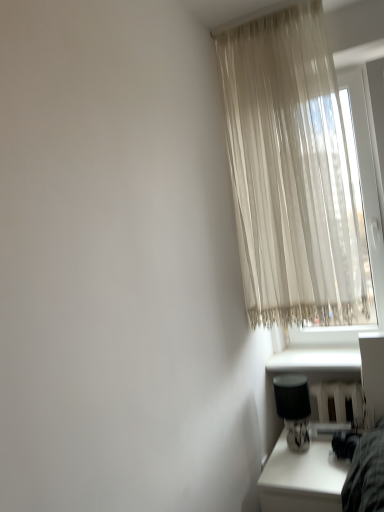
I want to click on free location above white smooth window sill at lower right (from a real-world perspective), so click(314, 348).